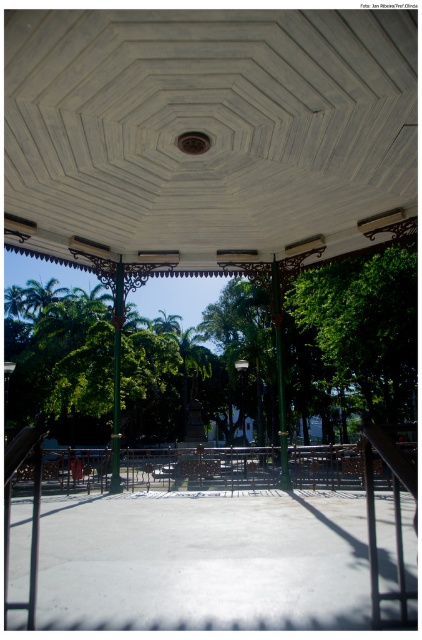
Question: Which of the following is the farthest from the observer?

Choices:
 (A) green leafy tree at right
 (B) green leafy tree at center

Answer: (B)

Question: Among these points, which one is farthest from the camera?

Choices:
 (A) (245, 291)
 (B) (400, 321)

Answer: (A)

Question: Considering the relative positions of green leafy tree at center and green leafy tree at right in the image provided, where is green leafy tree at center located with respect to green leafy tree at right?

Choices:
 (A) left
 (B) right

Answer: (A)

Question: Is green leafy tree at center below green leafy tree at right?

Choices:
 (A) no
 (B) yes

Answer: (B)

Question: Which object is closer to the camera taking this photo?

Choices:
 (A) green leafy tree at right
 (B) green leafy tree at center

Answer: (A)

Question: Does green leafy tree at center come behind green leafy tree at right?

Choices:
 (A) no
 (B) yes

Answer: (B)